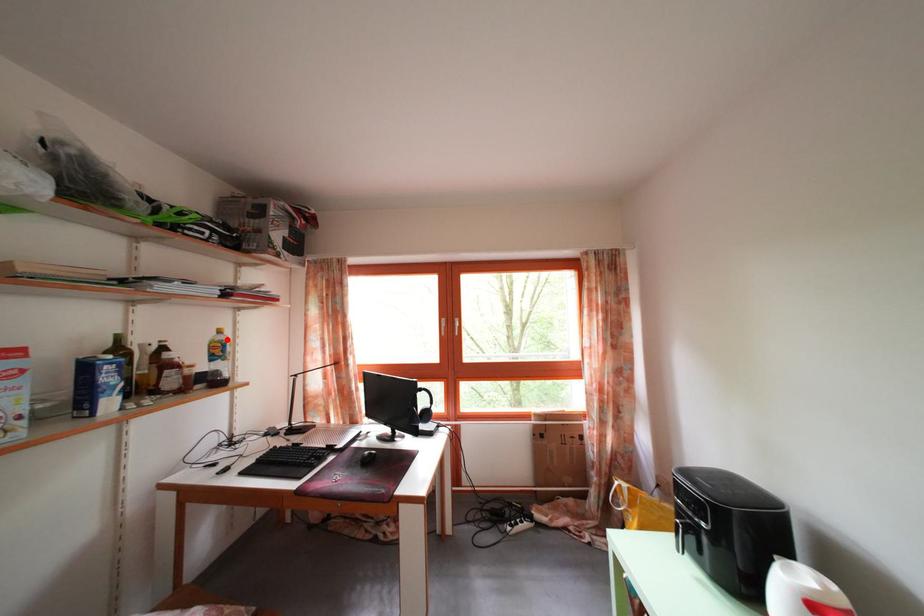
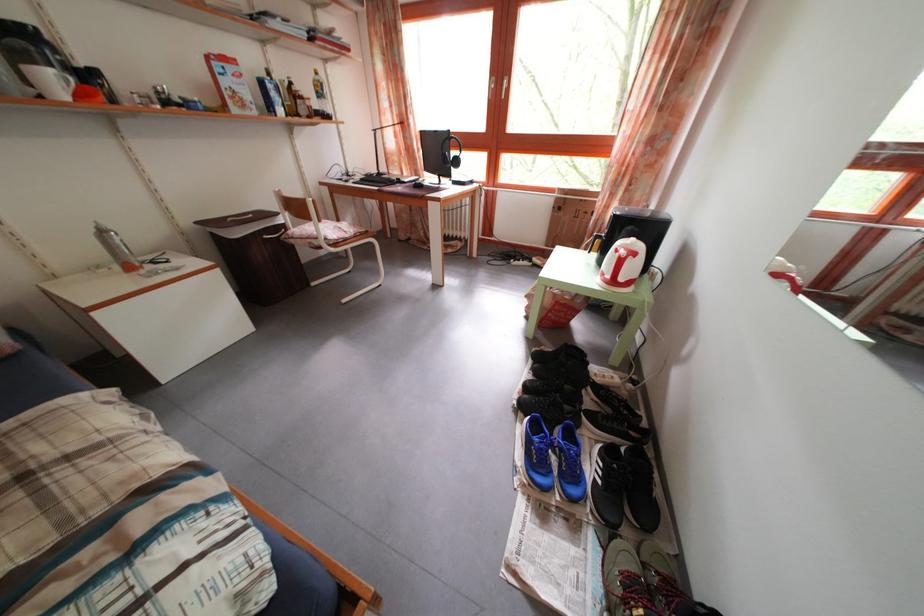
Find the pixel in the second image that matches the highlighted location in the first image.

(323, 79)